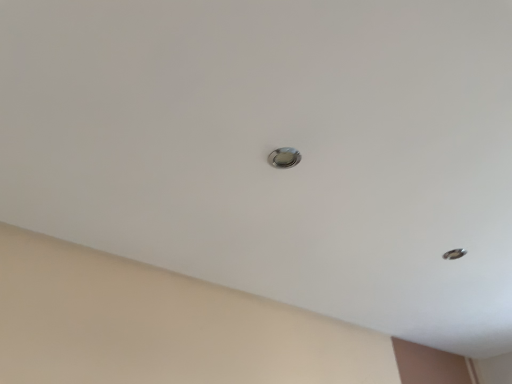
Question: Is satin silver door handle at center to the left or to the right of metallic hole at upper right in the image?

Choices:
 (A) left
 (B) right

Answer: (A)

Question: Does point (296, 160) appear closer or farther from the camera than point (441, 256)?

Choices:
 (A) closer
 (B) farther

Answer: (A)

Question: In terms of width, does satin silver door handle at center look wider or thinner when compared to metallic hole at upper right?

Choices:
 (A) wide
 (B) thin

Answer: (B)

Question: Looking at their shapes, would you say metallic hole at upper right is wider or thinner than satin silver door handle at center?

Choices:
 (A) wide
 (B) thin

Answer: (A)

Question: Considering the positions of metallic hole at upper right and satin silver door handle at center in the image, is metallic hole at upper right taller or shorter than satin silver door handle at center?

Choices:
 (A) tall
 (B) short

Answer: (A)

Question: From a real-world perspective, relative to satin silver door handle at center, is metallic hole at upper right vertically above or below?

Choices:
 (A) above
 (B) below

Answer: (A)

Question: Considering their positions, is metallic hole at upper right located in front of or behind satin silver door handle at center?

Choices:
 (A) behind
 (B) front

Answer: (A)